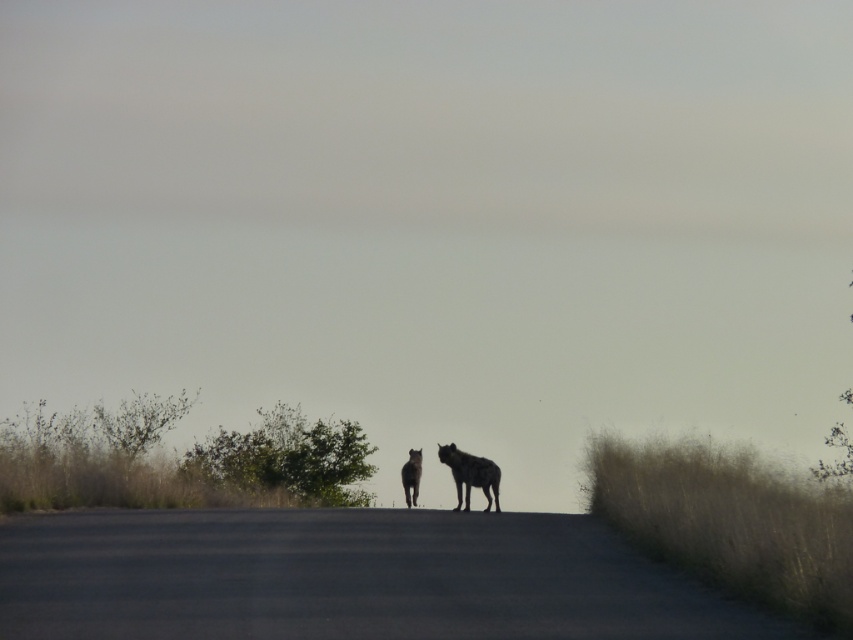
Is spotted fur hyena at center positioned in front of black fur hyena at center?

Yes.

Who is positioned more to the left, spotted fur hyena at center or black fur hyena at center?

black fur hyena at center is more to the left.

You are a GUI agent. You are given a task and a screenshot of the screen. Output one action in this format:
    pyautogui.click(x=<x>, y=<y>)
    Task: Click on the spotted fur hyena at center
    
    Given the screenshot: What is the action you would take?
    pyautogui.click(x=469, y=474)

Image resolution: width=853 pixels, height=640 pixels. I want to click on spotted fur hyena at center, so click(469, 474).